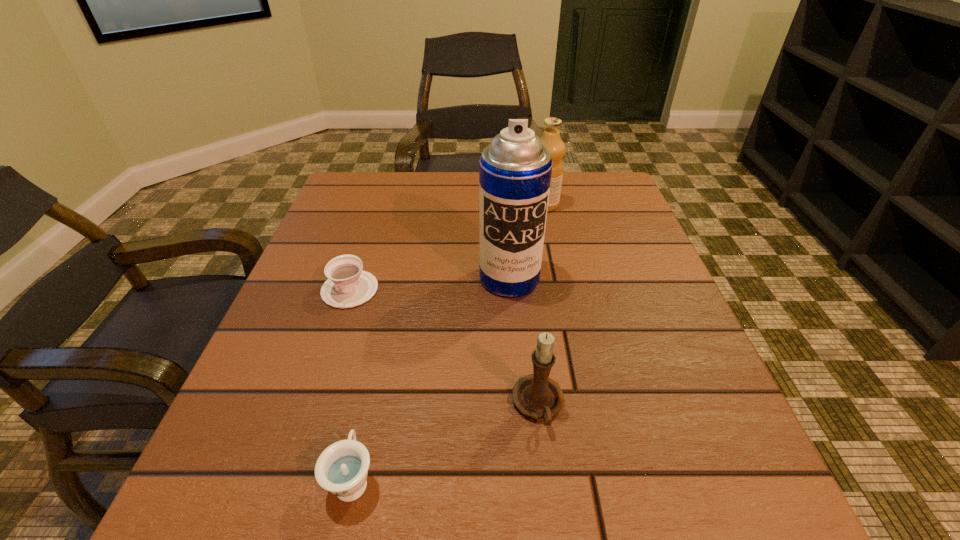
Image resolution: width=960 pixels, height=540 pixels. Identify the location of free point between the aerosol can and the fourth farthest object. (524, 342).

Image resolution: width=960 pixels, height=540 pixels. In order to click on vacant point located between the farther teacup and the olive oil in this screenshot , I will do `click(447, 247)`.

Where is `free spot between the third shortest object and the aerosol can`? The width and height of the screenshot is (960, 540). free spot between the third shortest object and the aerosol can is located at coordinates (524, 342).

Identify the location of vacant space that's between the farthest object and the third tallest object. click(x=541, y=305).

At what (x,y) coordinates should I click in order to perform the action: click on empty space between the nearest object and the third shortest object. Please return your answer as a coordinate pair (x, y). This screenshot has width=960, height=540. Looking at the image, I should click on (445, 442).

Identify which object is the fourth closest to the farther teacup. Please provide its 2D coordinates. Your answer should be formatted as a tuple, i.e. [(x, y)], where the tuple contains the x and y coordinates of a point satisfying the conditions above.

[(551, 139)]

This screenshot has height=540, width=960. What are the coordinates of `object that is the closest to the fourth farthest object` in the screenshot? It's located at (515, 170).

This screenshot has height=540, width=960. What are the coordinates of `blank space that satisfies the following two spatial constraints: 1. on the label of the olive oil; 2. on the handle side of the farther teacup` in the screenshot? It's located at (562, 289).

Locate an element on the screen. The width and height of the screenshot is (960, 540). free spot that satisfies the following two spatial constraints: 1. on the label of the fourth shortest object; 2. on the handle side of the farther teacup is located at coordinates (562, 289).

Locate an element on the screen. vacant space that satisfies the following two spatial constraints: 1. on the label of the olive oil; 2. on the side of the fourth farthest object with the handle is located at coordinates (586, 406).